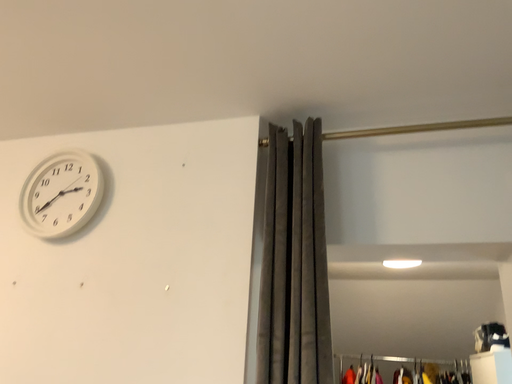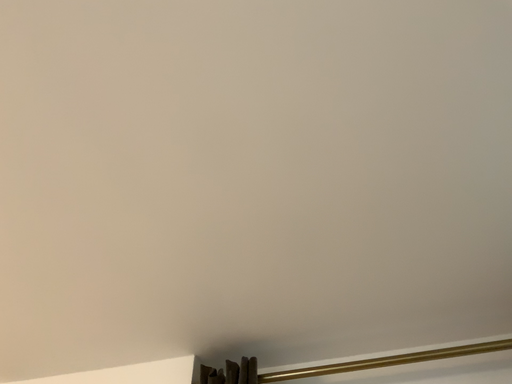
Question: Which way did the camera rotate in the video?

Choices:
 (A) rotated upward
 (B) rotated downward

Answer: (A)